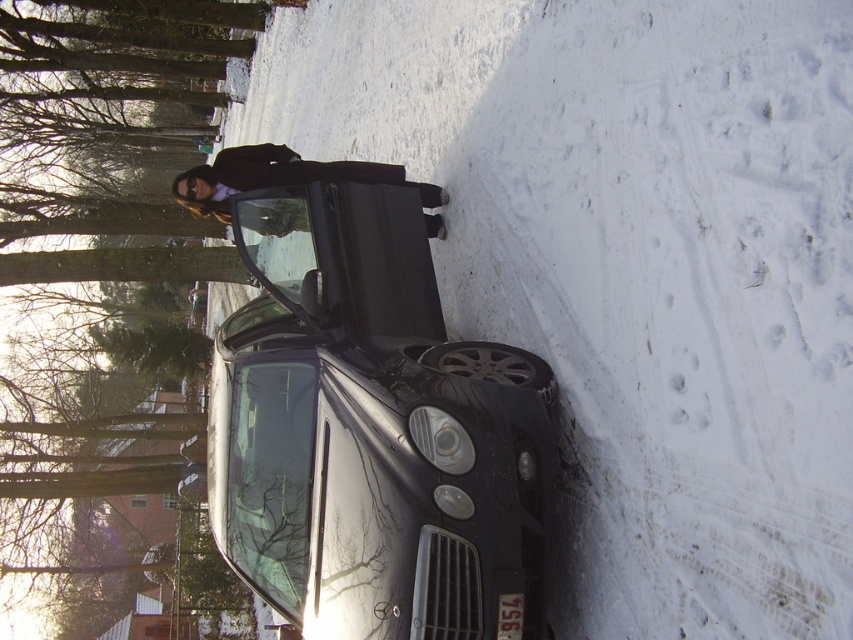
Question: Where is white powdery snow at center located in relation to glossy black car at center in the image?

Choices:
 (A) above
 (B) below

Answer: (A)

Question: Which of the following is the farthest from the observer?

Choices:
 (A) (511, 621)
 (B) (291, 150)
 (C) (782, 435)
 (D) (450, 508)

Answer: (B)

Question: Can you confirm if white powdery snow at center is thinner than black plastic license plate at lower center?

Choices:
 (A) no
 (B) yes

Answer: (A)

Question: Which of the following is the farthest from the observer?

Choices:
 (A) glossy black car at center
 (B) black fabric coat at center
 (C) white powdery snow at center

Answer: (B)

Question: Can you confirm if white powdery snow at center is positioned to the right of black fabric coat at center?

Choices:
 (A) no
 (B) yes

Answer: (B)

Question: Which of the following is the farthest from the observer?

Choices:
 (A) (236, 486)
 (B) (550, 330)
 (C) (521, 600)

Answer: (B)